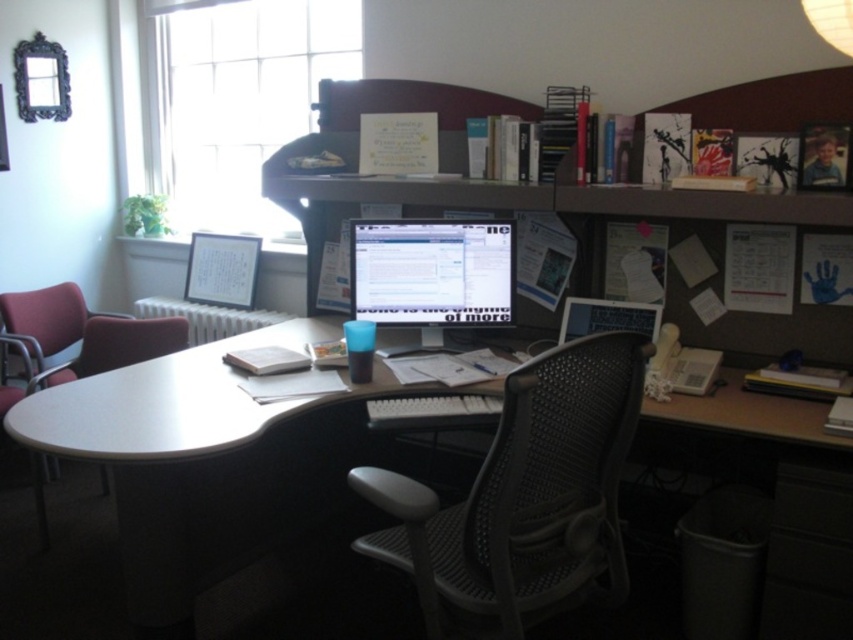
You are standing in the office and want to place a new item exactly at the point labeled as point (157, 404). According to the scene description, what object is located at that specific point?

The smooth white desk at center is located at point (157, 404).

You are a delivery person who needs to place a small package between the black mesh swivel chair at center and the matte plastic monitor at center. The package is 12 inches long. Can you fit it there?

The distance between the black mesh swivel chair at center and the matte plastic monitor at center is 35.91 inches, so yes, the 12 inch package can fit between them.

You are sitting in the black mesh swivel chair at center facing the matte plastic monitor at center. If you turn your head to look behind you, which object will be out of your view?

The black mesh swivel chair at center is in front of the matte plastic monitor at center, so when you turn your head to look behind you, the matte plastic monitor at center will be out of your view.